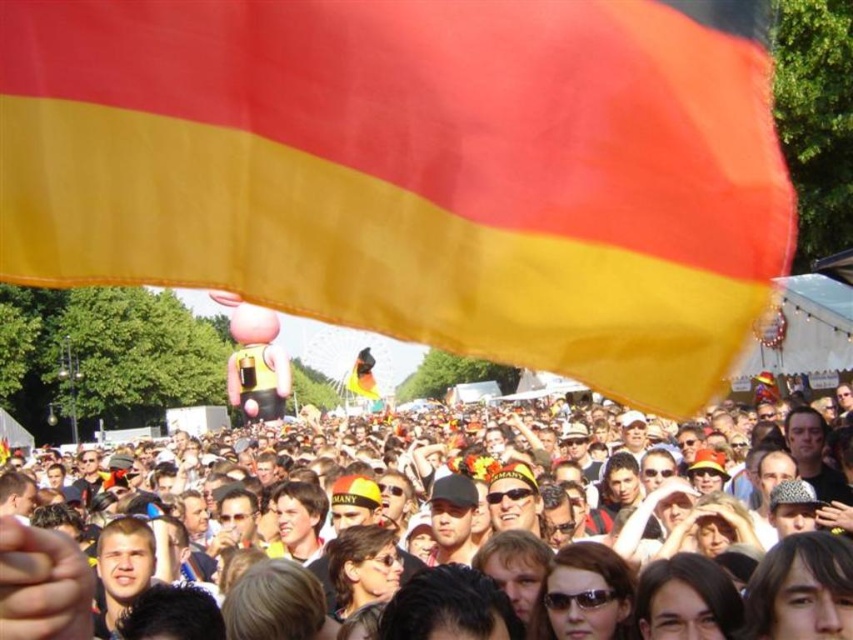
You are a photographer trying to capture both the matte fabric flag at upper center and the matte yellow flag at upper center in the same frame. Given their positions and sizes, which flag would require you to zoom out more to include its entire width in the photo?

The matte fabric flag at upper center requires zooming out more because its width surpasses that of the matte yellow flag at upper center, making it necessary to adjust the camera to accommodate its larger size.

You are a photographer trying to capture a clear shot of both the matte fabric flag at upper center and the matte yellow flag at upper center. Given their sizes, which flag should you focus on first to ensure it fits entirely within your camera frame?

The matte fabric flag at upper center has a larger size compared to matte yellow flag at upper center, so you should focus on capturing the matte fabric flag at upper center first to ensure it fits entirely within your camera frame before adjusting for the smaller one.

You are a drone operator trying to capture a photo of both the matte fabric flag at upper center and the matte yellow flag at upper center from above. The drone has a camera with a maximum horizontal field of view of 60 feet. Can the drone capture both flags in a single photo without moving?

The matte fabric flag at upper center and matte yellow flag at upper center are 73.59 feet apart from each other. Since the drone camera has a maximum horizontal field of view of 60 feet, the distance between the flags exceeds the camera range. Therefore, the drone cannot capture both flags in a single photo without moving.